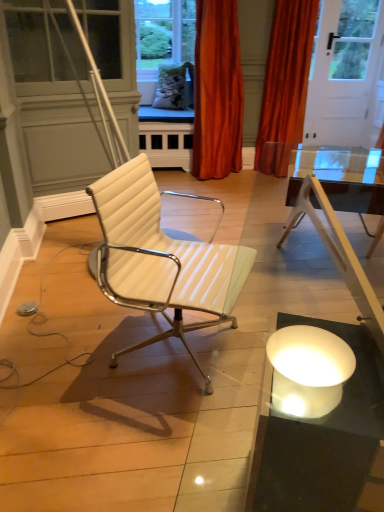
The height and width of the screenshot is (512, 384). What do you see at coordinates (160, 259) in the screenshot?
I see `white leather chair at center` at bounding box center [160, 259].

Find the location of a particular element. white leather chair at center is located at coordinates (160, 259).

This screenshot has width=384, height=512. Find the location of `orange velvet curtain at upper right, the second curtain when ordered from left to right`. orange velvet curtain at upper right, the second curtain when ordered from left to right is located at coordinates (287, 73).

This screenshot has width=384, height=512. I want to click on white leather chair at center, so click(160, 259).

Which object is further away from the camera, white leather chair at center or orange velvet curtain at upper right, acting as the 1th curtain starting from the right?

Positioned behind is orange velvet curtain at upper right, acting as the 1th curtain starting from the right.

From a real-world perspective, is white leather chair at center located beneath orange velvet curtain at upper right, the second curtain when ordered from left to right?

Yes, from a real-world perspective, white leather chair at center is beneath orange velvet curtain at upper right, the second curtain when ordered from left to right.

Between white leather chair at center and orange velvet curtain at upper right, acting as the 1th curtain starting from the right, which one has larger size?

orange velvet curtain at upper right, acting as the 1th curtain starting from the right.

From the image's perspective, is white leather chair at center positioned above or below orange velvet curtain at upper right, the second curtain when ordered from left to right?

white leather chair at center is situated lower than orange velvet curtain at upper right, the second curtain when ordered from left to right, in the image.

Is white leather chair at center positioned in front of orange velvet curtain at upper center, acting as the first curtain starting from the left?

Yes, it is.

Is white leather chair at center positioned with its back to orange velvet curtain at upper center, acting as the first curtain starting from the left?

No, white leather chair at center's orientation is not away from orange velvet curtain at upper center, acting as the first curtain starting from the left.

Is point (213, 302) more distant than point (213, 111)?

No, (213, 302) is in front of (213, 111).

Consider the image. Is white leather chair at center next to orange velvet curtain at upper center, which is the second curtain from right to left?

→ No, white leather chair at center is not beside orange velvet curtain at upper center, which is the second curtain from right to left.

Is orange velvet curtain at upper right, acting as the 1th curtain starting from the right, positioned far away from orange velvet curtain at upper center, which is the second curtain from right to left?

No.

Based on the photo, from a real-world perspective, is orange velvet curtain at upper right, acting as the 1th curtain starting from the right, positioned above or below orange velvet curtain at upper center, which is the second curtain from right to left?

From a real-world perspective, orange velvet curtain at upper right, acting as the 1th curtain starting from the right, is physically above orange velvet curtain at upper center, which is the second curtain from right to left.

Looking at this image, between orange velvet curtain at upper right, acting as the 1th curtain starting from the right, and orange velvet curtain at upper center, which is the second curtain from right to left, which one appears on the right side from the viewer's perspective?

orange velvet curtain at upper right, acting as the 1th curtain starting from the right.

Is point (266, 89) behind point (200, 84)?

Yes, point (266, 89) is farther from viewer.

Find the location of `chair that appears below the orange velvet curtain at upper right, acting as the 1th curtain starting from the right (from a real-world perspective)`. chair that appears below the orange velvet curtain at upper right, acting as the 1th curtain starting from the right (from a real-world perspective) is located at coordinates (160, 259).

Is orange velvet curtain at upper right, acting as the 1th curtain starting from the right, thinner than white leather chair at center?

Indeed, orange velvet curtain at upper right, acting as the 1th curtain starting from the right, has a lesser width compared to white leather chair at center.

Between orange velvet curtain at upper right, the second curtain when ordered from left to right, and white leather chair at center, which one is positioned behind?

orange velvet curtain at upper right, the second curtain when ordered from left to right, is further away from the camera.

Does orange velvet curtain at upper center, which is the second curtain from right to left, touch orange velvet curtain at upper right, acting as the 1th curtain starting from the right?

They are not placed beside each other.

Measure the distance from orange velvet curtain at upper center, acting as the first curtain starting from the left, to orange velvet curtain at upper right, acting as the 1th curtain starting from the right.

orange velvet curtain at upper center, acting as the first curtain starting from the left, is 18.86 inches from orange velvet curtain at upper right, acting as the 1th curtain starting from the right.

Is orange velvet curtain at upper center, which is the second curtain from right to left, facing away from orange velvet curtain at upper right, the second curtain when ordered from left to right?

No.

From the picture: Is orange velvet curtain at upper center, acting as the first curtain starting from the left, at the right side of orange velvet curtain at upper right, the second curtain when ordered from left to right?

No.

In the image, is orange velvet curtain at upper center, acting as the first curtain starting from the left, positioned in front of or behind white leather chair at center?

orange velvet curtain at upper center, acting as the first curtain starting from the left, is positioned farther from the viewer than white leather chair at center.

The width and height of the screenshot is (384, 512). What are the coordinates of `the 1st curtain positioned above the white leather chair at center (from a real-world perspective)` in the screenshot? It's located at (217, 91).

How many degrees apart are the facing directions of orange velvet curtain at upper center, which is the second curtain from right to left, and white leather chair at center?

→ The angle between the facing direction of orange velvet curtain at upper center, which is the second curtain from right to left, and the facing direction of white leather chair at center is 64.5 degrees.

Between orange velvet curtain at upper center, which is the second curtain from right to left, and white leather chair at center, which one has smaller size?

Smaller between the two is white leather chair at center.

Find the location of a particular element. curtain that is the 2nd one when counting rightward from the white leather chair at center is located at coordinates (287, 73).

From a real-world perspective, starting from the white leather chair at center, which curtain is the 1st one vertically above it? Please provide its 2D coordinates.

[(217, 91)]

Which object lies nearer to the anchor point orange velvet curtain at upper right, the second curtain when ordered from left to right, orange velvet curtain at upper center, which is the second curtain from right to left, or white leather chair at center?

orange velvet curtain at upper center, which is the second curtain from right to left.

Estimate the real-world distances between objects in this image. Which object is further from white leather chair at center, orange velvet curtain at upper center, acting as the first curtain starting from the left, or orange velvet curtain at upper right, the second curtain when ordered from left to right?

Based on the image, orange velvet curtain at upper right, the second curtain when ordered from left to right, appears to be further to white leather chair at center.

When comparing their distances from white leather chair at center, does orange velvet curtain at upper right, acting as the 1th curtain starting from the right, or orange velvet curtain at upper center, acting as the first curtain starting from the left, seem closer?

Among the two, orange velvet curtain at upper center, acting as the first curtain starting from the left, is located nearer to white leather chair at center.

When comparing their distances from orange velvet curtain at upper right, the second curtain when ordered from left to right, does white leather chair at center or orange velvet curtain at upper center, which is the second curtain from right to left, seem further?

white leather chair at center is positioned further to the anchor orange velvet curtain at upper right, the second curtain when ordered from left to right.

From the image, which object appears to be farther from orange velvet curtain at upper center, which is the second curtain from right to left, white leather chair at center or orange velvet curtain at upper right, acting as the 1th curtain starting from the right?

The object further to orange velvet curtain at upper center, which is the second curtain from right to left, is white leather chair at center.

Which object lies further to the anchor point orange velvet curtain at upper center, which is the second curtain from right to left, orange velvet curtain at upper right, the second curtain when ordered from left to right, or white leather chair at center?

white leather chair at center is positioned further to the anchor orange velvet curtain at upper center, which is the second curtain from right to left.

At what (x,y) coordinates should I click in order to perform the action: click on curtain positioned between white leather chair at center and orange velvet curtain at upper right, acting as the 1th curtain starting from the right, from near to far. Please return your answer as a coordinate pair (x, y). The image size is (384, 512). Looking at the image, I should click on (217, 91).